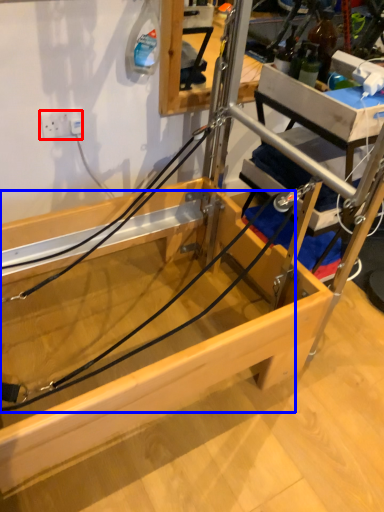
Question: Which object appears closest to the camera in this image, electric outlet (highlighted by a red box) or string (highlighted by a blue box)?

Choices:
 (A) electric outlet
 (B) string

Answer: (B)